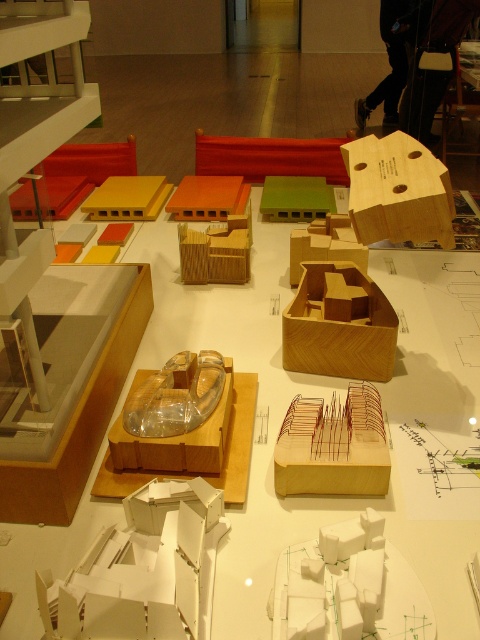
Is point (385, 177) positioned after point (216, 461)?

Yes.

In order to click on wooden box at center-right in this screenshot , I will do click(397, 189).

Based on the photo, can you confirm if wooden model at center is thinner than wooden box at center-right?

No, wooden model at center is not thinner than wooden box at center-right.

Does wooden model at center have a smaller size compared to wooden box at center-right?

Incorrect, wooden model at center is not smaller in size than wooden box at center-right.

Image resolution: width=480 pixels, height=640 pixels. In order to click on wooden model at center in this screenshot , I will do (x=276, y=436).

Who is higher up, transparent plastic box at center or wooden cube at center?

Positioned higher is wooden cube at center.

Does transparent plastic box at center have a smaller size compared to wooden cube at center?

Yes, transparent plastic box at center is smaller than wooden cube at center.

The height and width of the screenshot is (640, 480). In order to click on transparent plastic box at center in this screenshot , I will do `click(177, 442)`.